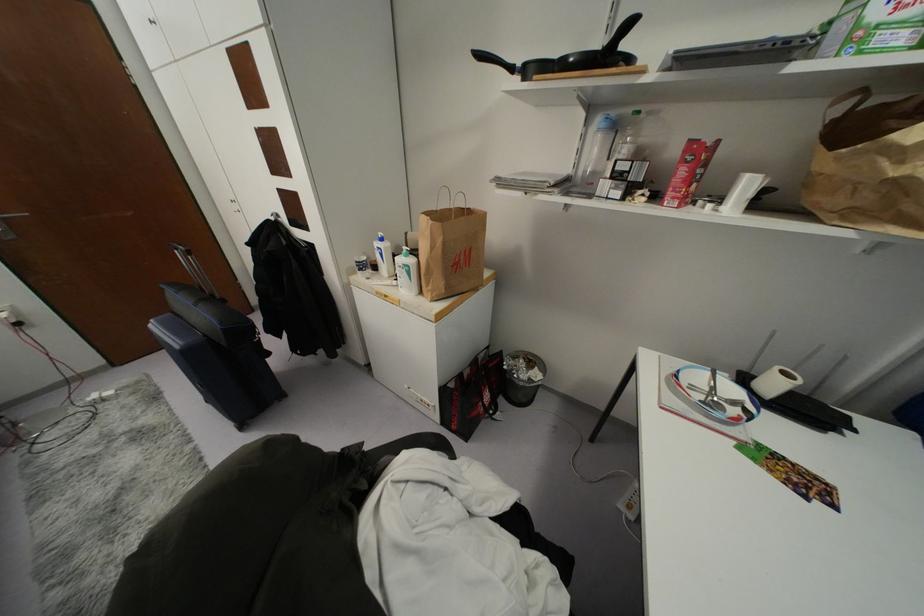
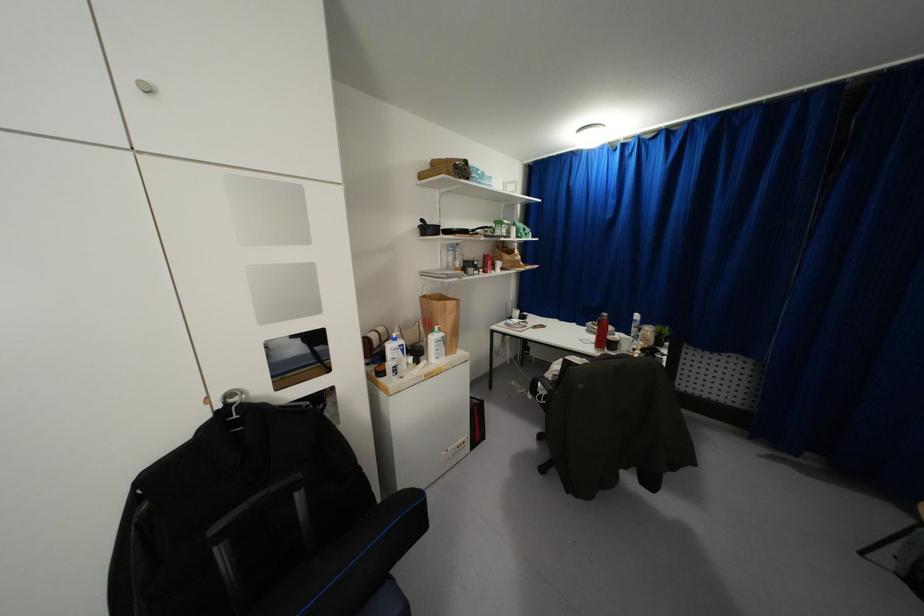
Locate, in the second image, the point that corresponds to the point at 410,261 in the first image.

(442, 333)